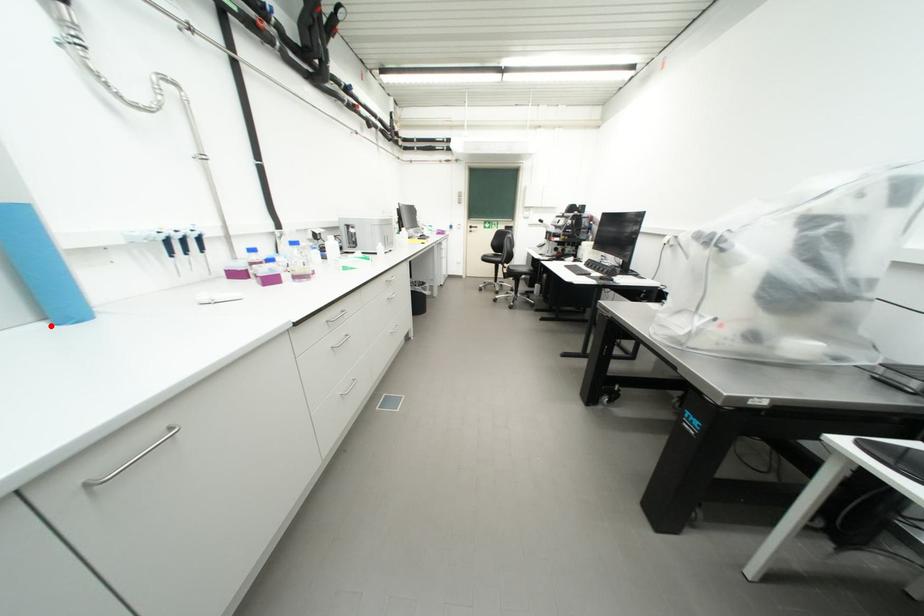
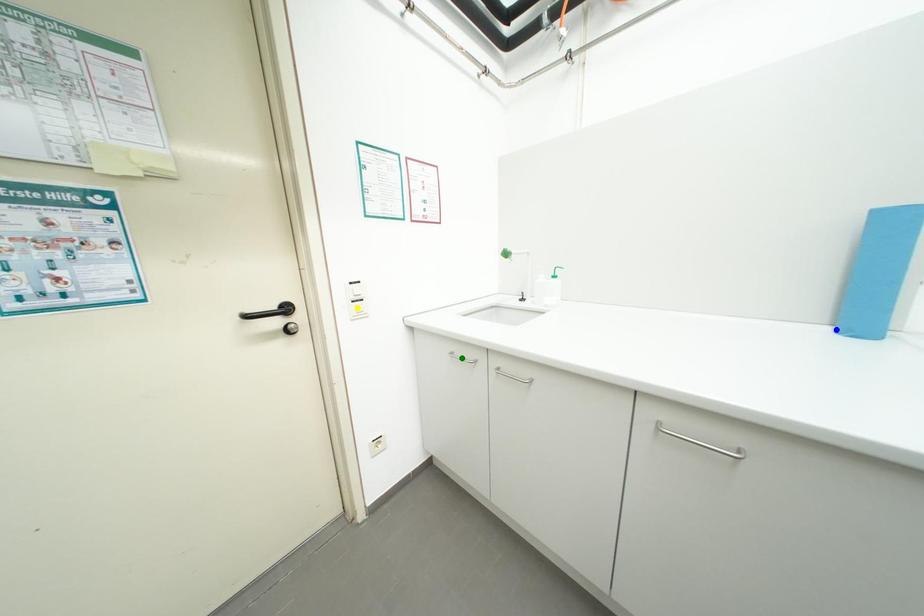
Question: I am providing you with two images of the same scene from different viewpoints. A red point is marked on the first image. You are given multiple points on the second image. Which point in image 2 represents the same 3d spot as the red point in image 1?

Choices:
 (A) blue point
 (B) green point
 (C) yellow point

Answer: (A)